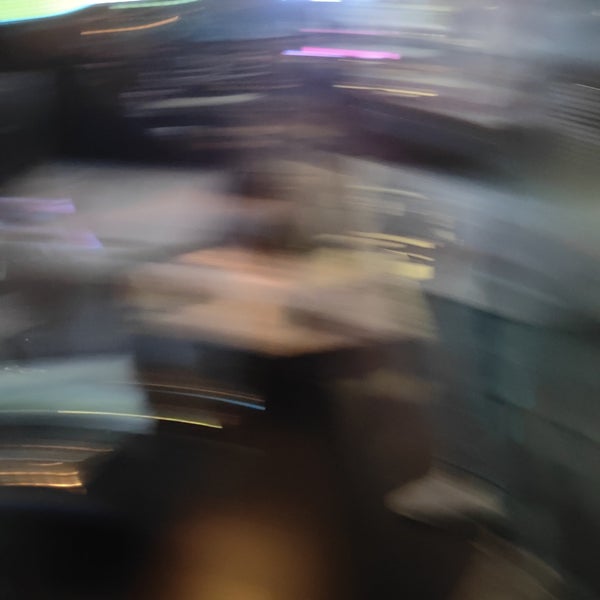
The width and height of the screenshot is (600, 600). Identify the location of grey blurry wall. (582, 352), (567, 460), (470, 440), (486, 338), (535, 361).